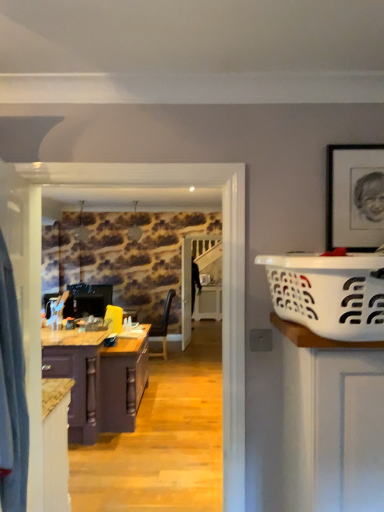
Identify the location of purple wood cabinet at left. (99, 381).

What do you see at coordinates (99, 381) in the screenshot? I see `purple wood cabinet at left` at bounding box center [99, 381].

The height and width of the screenshot is (512, 384). Identify the location of white plastic laundry basket at right. (329, 293).

The image size is (384, 512). Describe the element at coordinates (329, 293) in the screenshot. I see `white plastic laundry basket at right` at that location.

At what (x,y) coordinates should I click in order to perform the action: click on purple wood cabinet at left. Please return your answer as a coordinate pair (x, y). Image resolution: width=384 pixels, height=512 pixels. Looking at the image, I should click on (99, 381).

Considering the relative positions of white plastic laundry basket at right and purple wood cabinet at left in the image provided, is white plastic laundry basket at right to the left or to the right of purple wood cabinet at left?

Clearly, white plastic laundry basket at right is on the right of purple wood cabinet at left in the image.

Considering their positions, is white plastic laundry basket at right located in front of or behind purple wood cabinet at left?

In the image, white plastic laundry basket at right appears in front of purple wood cabinet at left.

From the picture: Which is less distant, (316, 289) or (81, 419)?

Point (316, 289).

From the image's perspective, which one is positioned higher, white plastic laundry basket at right or purple wood cabinet at left?

white plastic laundry basket at right appears higher in the image.

From a real-world perspective, is white plastic laundry basket at right physically below purple wood cabinet at left?

No, from a real-world perspective, white plastic laundry basket at right is not beneath purple wood cabinet at left.

Considering the sizes of white plastic laundry basket at right and purple wood cabinet at left in the image, is white plastic laundry basket at right wider or thinner than purple wood cabinet at left?

white plastic laundry basket at right is thinner than purple wood cabinet at left.

In terms of height, does white plastic laundry basket at right look taller or shorter compared to purple wood cabinet at left?

Clearly, white plastic laundry basket at right is shorter compared to purple wood cabinet at left.

Can you confirm if white plastic laundry basket at right is smaller than purple wood cabinet at left?

Correct, white plastic laundry basket at right occupies less space than purple wood cabinet at left.

Is white plastic laundry basket at right spatially inside purple wood cabinet at left, or outside of it?

white plastic laundry basket at right is spatially situated outside purple wood cabinet at left.

Is the surface of white plastic laundry basket at right in direct contact with purple wood cabinet at left?

No, white plastic laundry basket at right is not making contact with purple wood cabinet at left.

From the picture: Is white plastic laundry basket at right positioned with its back to purple wood cabinet at left?

No, purple wood cabinet at left is not at the back of white plastic laundry basket at right.

The height and width of the screenshot is (512, 384). I want to click on basket in front of the purple wood cabinet at left, so click(x=329, y=293).

Is purple wood cabinet at left to the left of white plastic laundry basket at right from the viewer's perspective?

Yes.

Between purple wood cabinet at left and white plastic laundry basket at right, which one is positioned in front?

white plastic laundry basket at right.

Which is further, (81,367) or (278,269)?

Point (81,367)

From the image's perspective, is purple wood cabinet at left located above or below white plastic laundry basket at right?

From the image's perspective, purple wood cabinet at left appears below white plastic laundry basket at right.

From a real-world perspective, is purple wood cabinet at left located higher than white plastic laundry basket at right?

No, from a real-world perspective, purple wood cabinet at left is not above white plastic laundry basket at right.

Consider the image. Between purple wood cabinet at left and white plastic laundry basket at right, which one has larger width?

purple wood cabinet at left.

Is purple wood cabinet at left taller than white plastic laundry basket at right?

Correct, purple wood cabinet at left is much taller as white plastic laundry basket at right.

Considering the relative sizes of purple wood cabinet at left and white plastic laundry basket at right in the image provided, is purple wood cabinet at left smaller than white plastic laundry basket at right?

Actually, purple wood cabinet at left might be larger than white plastic laundry basket at right.

Is purple wood cabinet at left spatially inside white plastic laundry basket at right, or outside of it?

purple wood cabinet at left exists outside the volume of white plastic laundry basket at right.

Can you see purple wood cabinet at left touching white plastic laundry basket at right?

No, purple wood cabinet at left is not with white plastic laundry basket at right.

Is purple wood cabinet at left aimed at white plastic laundry basket at right?

No, purple wood cabinet at left is not turned towards white plastic laundry basket at right.

How much distance is there between purple wood cabinet at left and white plastic laundry basket at right?

They are 8.82 feet apart.

Locate an element on the screen. The height and width of the screenshot is (512, 384). cabinetry lying below the white plastic laundry basket at right (from the image's perspective) is located at coordinates click(x=99, y=381).

Locate an element on the screen. This screenshot has width=384, height=512. basket in front of the purple wood cabinet at left is located at coordinates (329, 293).

Locate an element on the screen. Image resolution: width=384 pixels, height=512 pixels. cabinetry lying behind the white plastic laundry basket at right is located at coordinates click(99, 381).